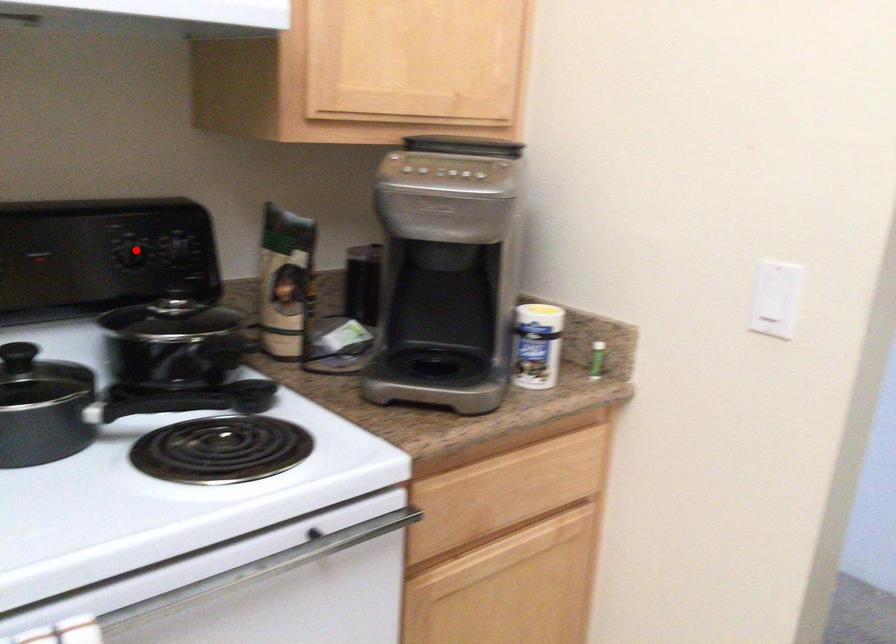
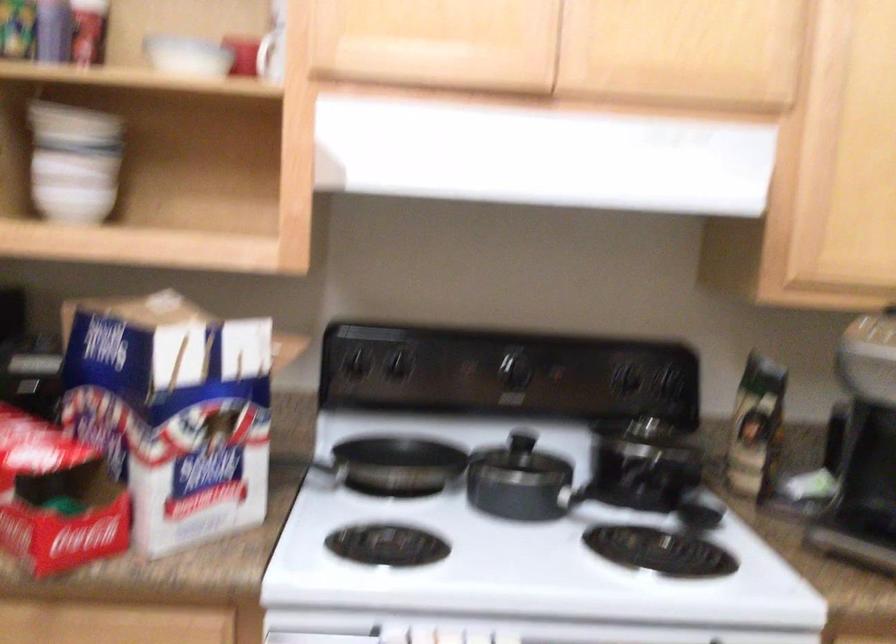
Question: A red point is marked in image1. In image2, is the corresponding 3D point closer to the camera or farther? Reply with the corresponding letter.

Choices:
 (A) The corresponding 3D point is closer.
 (B) The corresponding 3D point is farther.

Answer: (B)